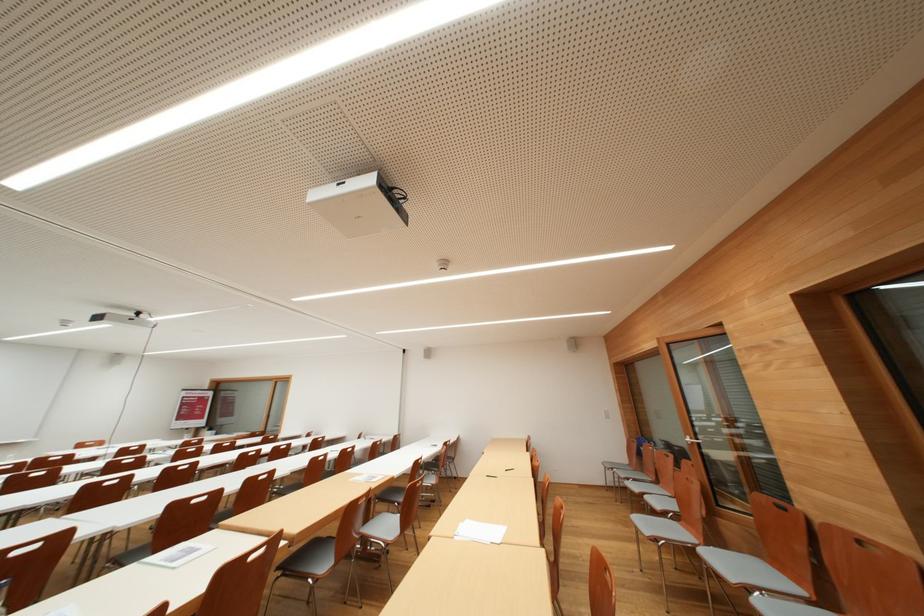
Find where to turn the silver door handle. Please return your answer as a coordinate pair (x, y).

(691, 440)